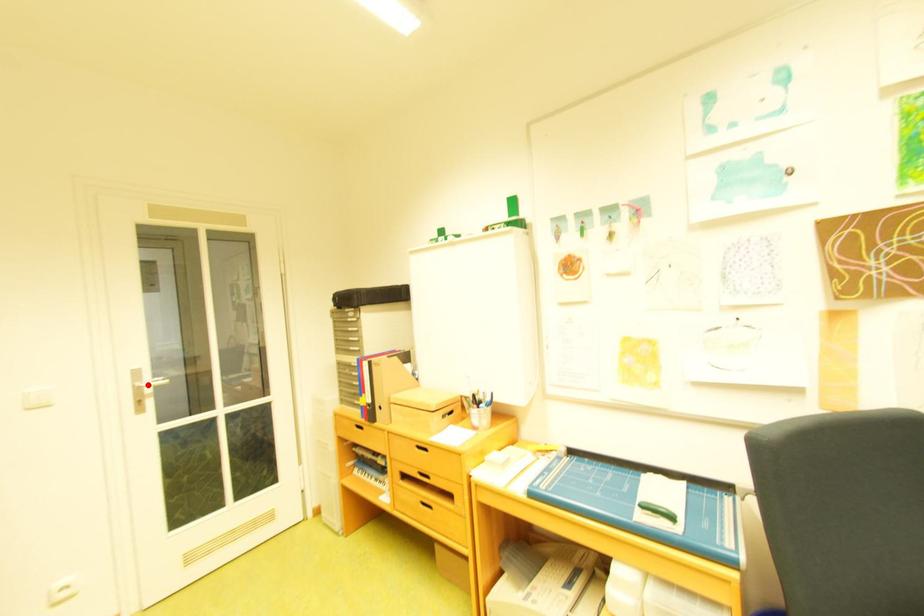
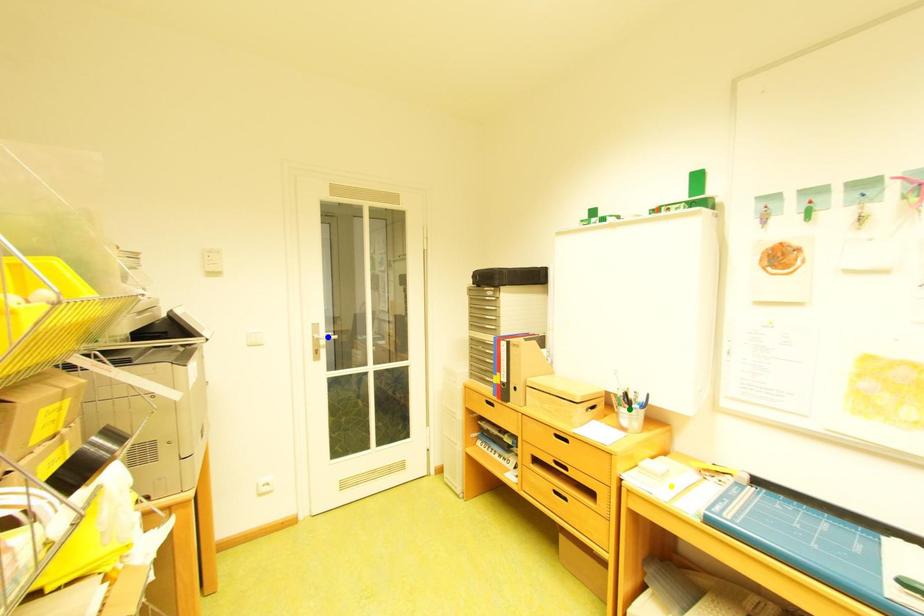
Question: I am providing you with two images of the same scene from different viewpoints. A red point is marked on the first image. You are given multiple points on the second image. Which point in image 2 is actually the same real-world point as the red point in image 1?

Choices:
 (A) yellow point
 (B) blue point
 (C) green point

Answer: (B)